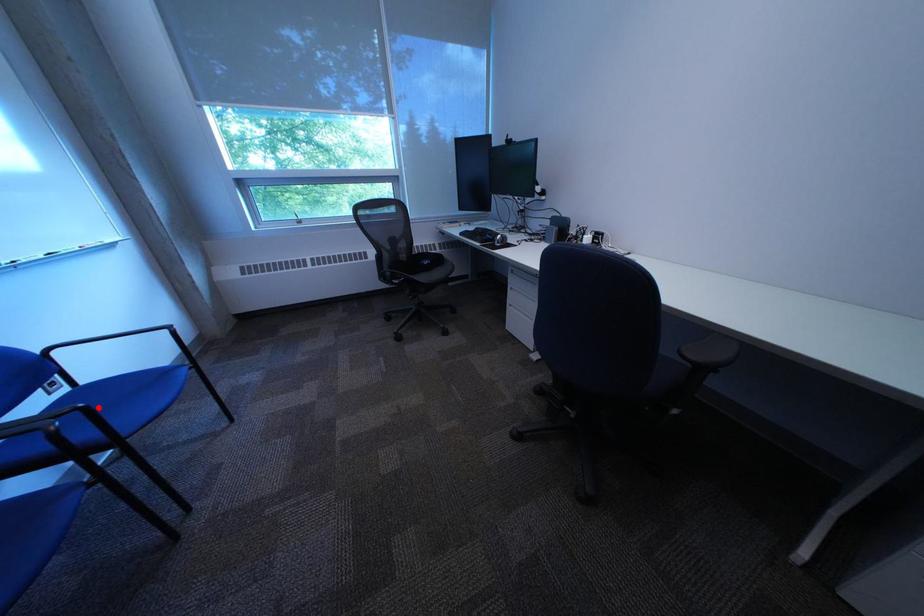
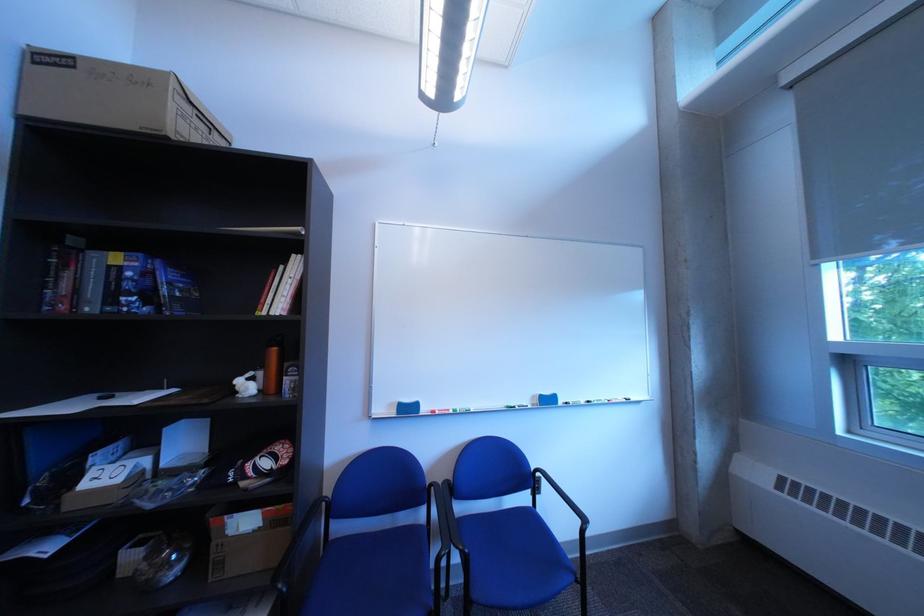
In the second image, find the point that corresponds to the highlighted location in the first image.

(482, 553)